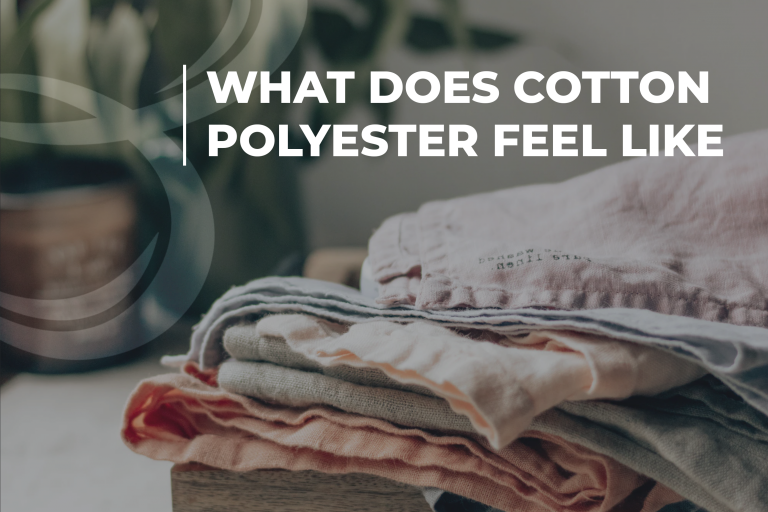
You are a GUI agent. You are given a task and a screenshot of the screen. Output one action in this format:
    pyautogui.click(x=<x>, y=<y>)
    Task: Click on the grey towel
    
    Given the screenshot: What is the action you would take?
    pyautogui.click(x=624, y=258)